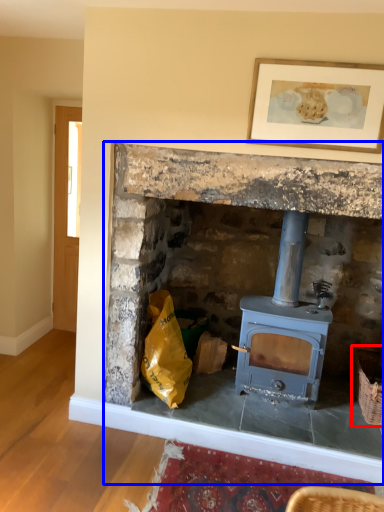
Question: Which object is further to the camera taking this photo, basket (highlighted by a red box) or fireplace (highlighted by a blue box)?

Choices:
 (A) basket
 (B) fireplace

Answer: (A)